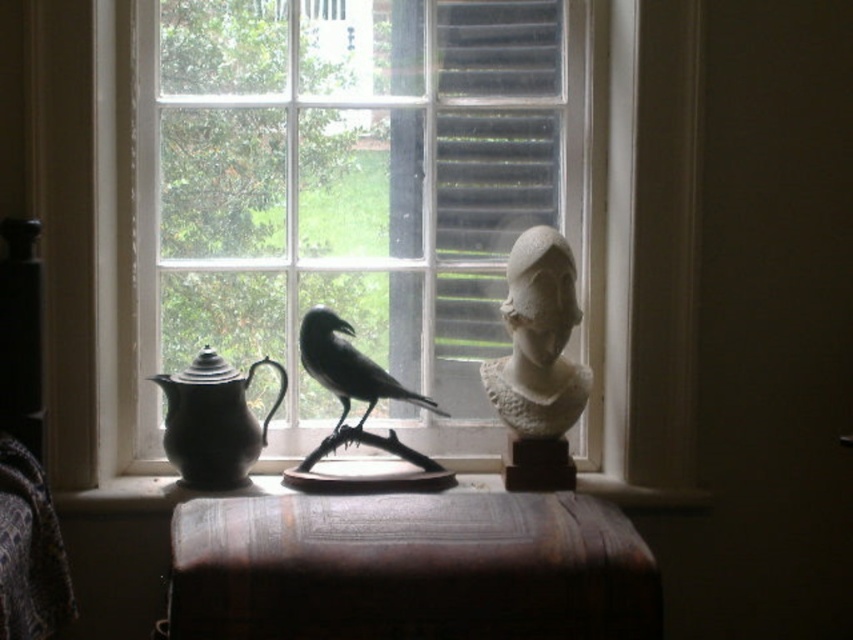
Question: Is leather-bound book at center above matte black teapot at left?

Choices:
 (A) no
 (B) yes

Answer: (A)

Question: From the image, what is the correct spatial relationship of wooden surface at center in relation to white stone bust at center?

Choices:
 (A) left
 (B) right

Answer: (A)

Question: Which point is closer to the camera?

Choices:
 (A) leather-bound book at center
 (B) white stone bust at center
 (C) matte black teapot at left

Answer: (A)

Question: Can you confirm if leather-bound book at center is positioned to the left of wooden surface at center?

Choices:
 (A) no
 (B) yes

Answer: (A)

Question: Which object is the farthest from the matte black teapot at left?

Choices:
 (A) white stone bust at center
 (B) wooden surface at center
 (C) clear glass window at center

Answer: (A)

Question: Which is nearer to the leather-bound book at center?

Choices:
 (A) clear glass window at center
 (B) shiny black bird at center
 (C) white stone bust at center
 (D) wooden surface at center

Answer: (B)